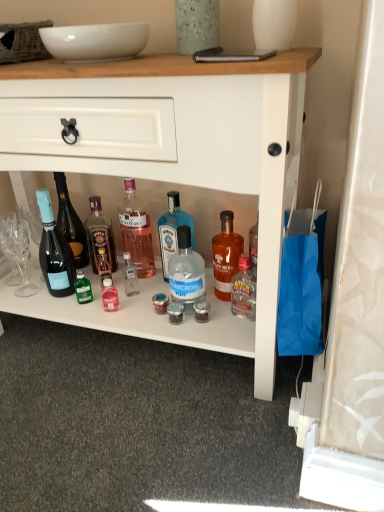
Question: Is white glossy vase at upper center, the 2th glass vase in the left-to-right sequence, located within white glossy bowl at upper center?

Choices:
 (A) yes
 (B) no

Answer: (B)

Question: From the image's perspective, is white glossy bowl at upper center beneath white glossy vase at upper center, the first glass vase in the right-to-left sequence?

Choices:
 (A) yes
 (B) no

Answer: (A)

Question: Does white glossy bowl at upper center have a lesser width compared to white glossy vase at upper center, the 2th glass vase in the left-to-right sequence?

Choices:
 (A) no
 (B) yes

Answer: (A)

Question: Can you confirm if white glossy bowl at upper center is wider than white glossy vase at upper center, the 2th glass vase in the left-to-right sequence?

Choices:
 (A) yes
 (B) no

Answer: (A)

Question: Is white glossy bowl at upper center positioned in front of white glossy vase at upper center, the first glass vase in the right-to-left sequence?

Choices:
 (A) no
 (B) yes

Answer: (A)

Question: In the image, is matte black champagne bottle at left, which is the first bottle in left-to-right order, on the left side or the right side of blue glass bottle at center, acting as the 3th bottle starting from the right?

Choices:
 (A) left
 (B) right

Answer: (A)

Question: Considering the positions of matte black champagne bottle at left, the sixth bottle positioned from the right, and blue glass bottle at center, acting as the 3th bottle starting from the right, in the image, is matte black champagne bottle at left, the sixth bottle positioned from the right, taller or shorter than blue glass bottle at center, acting as the 3th bottle starting from the right,?

Choices:
 (A) short
 (B) tall

Answer: (B)

Question: From a real-world perspective, is matte black champagne bottle at left, the sixth bottle positioned from the right, positioned above or below blue glass bottle at center, which ranks as the fourth bottle in left-to-right order?

Choices:
 (A) above
 (B) below

Answer: (A)

Question: Considering the positions of point (51, 232) and point (173, 231), is point (51, 232) closer or farther from the camera than point (173, 231)?

Choices:
 (A) farther
 (B) closer

Answer: (A)

Question: From a real-world perspective, relative to speckled glass vase at upper center, which appears as the 2th glass vase when viewed from the right, is blue glass bottle at center, acting as the 3th bottle starting from the right, vertically above or below?

Choices:
 (A) above
 (B) below

Answer: (B)

Question: Choose the correct answer: Is blue glass bottle at center, which ranks as the fourth bottle in left-to-right order, inside speckled glass vase at upper center, which appears as the 2th glass vase when viewed from the right, or outside it?

Choices:
 (A) outside
 (B) inside

Answer: (A)

Question: Is blue glass bottle at center, which ranks as the fourth bottle in left-to-right order, to the left or to the right of speckled glass vase at upper center, acting as the first glass vase starting from the left, in the image?

Choices:
 (A) left
 (B) right

Answer: (A)

Question: Relative to speckled glass vase at upper center, which appears as the 2th glass vase when viewed from the right, is blue glass bottle at center, which ranks as the fourth bottle in left-to-right order, in front or behind?

Choices:
 (A) front
 (B) behind

Answer: (B)

Question: From the image's perspective, is matte orange glass bottle at center, which is the 1th bottle from right to left, above or below translucent glass bottle at center, arranged as the 2th bottle when viewed from the left?

Choices:
 (A) above
 (B) below

Answer: (B)

Question: Is matte orange glass bottle at center, which is the 1th bottle from right to left, bigger or smaller than translucent glass bottle at center, arranged as the 2th bottle when viewed from the left?

Choices:
 (A) small
 (B) big

Answer: (B)